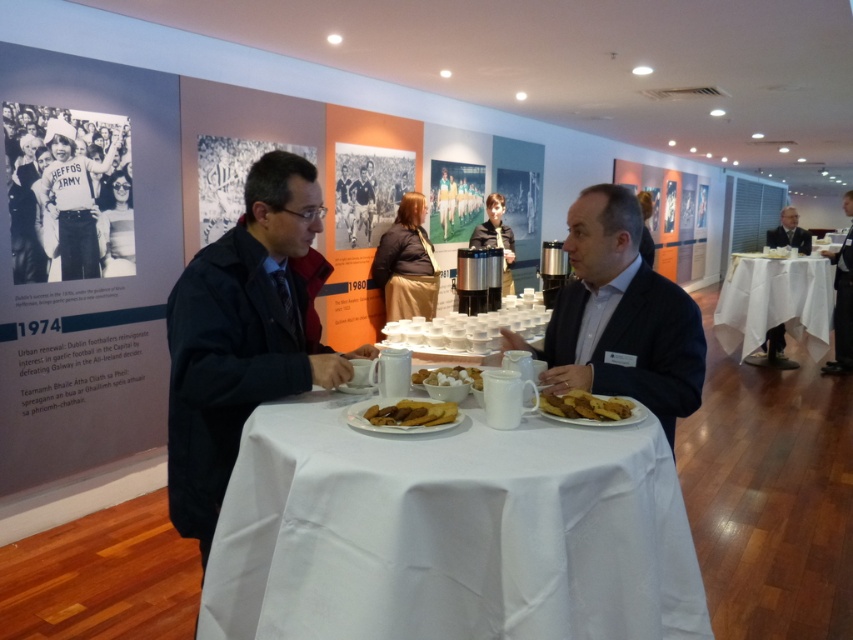
Can you confirm if dark blue suit at right is thinner than dark suit at right?

No.

Does dark blue suit at right appear on the left side of dark suit at right?

Indeed, dark blue suit at right is positioned on the left side of dark suit at right.

Is point (849, 230) positioned before point (766, 340)?

Yes, point (849, 230) is in front of point (766, 340).

Locate an element on the screen. The width and height of the screenshot is (853, 640). dark blue suit at right is located at coordinates (840, 307).

What do you see at coordinates (450, 532) in the screenshot?
I see `white cloth at center` at bounding box center [450, 532].

Where is `white cloth at center`? This screenshot has width=853, height=640. white cloth at center is located at coordinates (450, 532).

Is golden crispy bread at center taller than golden brown crispy pastry at center?

Indeed, golden crispy bread at center has a greater height compared to golden brown crispy pastry at center.

Is golden crispy bread at center positioned at the back of golden brown crispy pastry at center?

Yes, it is behind golden brown crispy pastry at center.

Which is in front, point (538, 403) or point (372, 412)?

Point (372, 412)

Find the location of a particular element. The height and width of the screenshot is (640, 853). golden crispy bread at center is located at coordinates (584, 404).